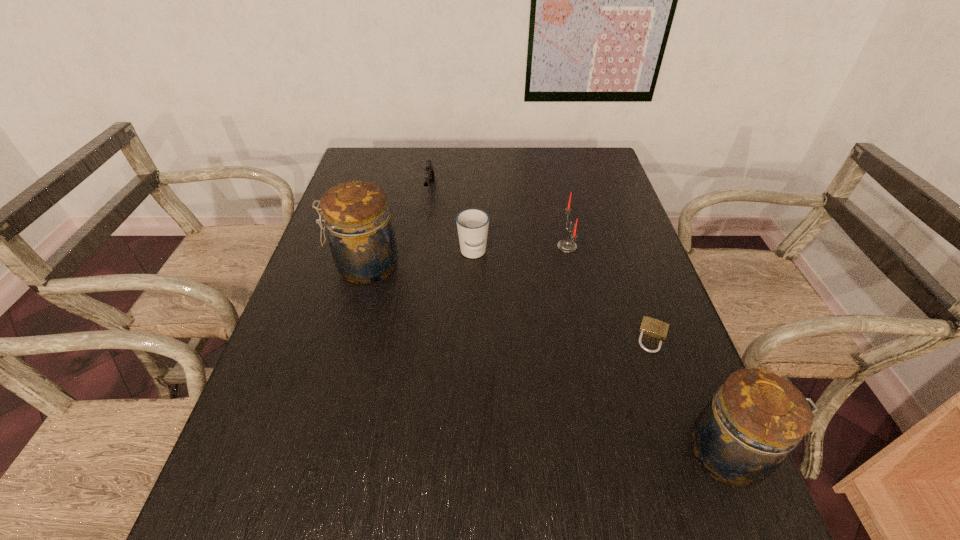
The width and height of the screenshot is (960, 540). Find the location of `object present at the left edge`. object present at the left edge is located at coordinates (361, 238).

Find the location of a particular element. jar located in the right edge section of the desktop is located at coordinates (741, 437).

Locate an element on the screen. This screenshot has height=540, width=960. padlock located in the right edge section of the desktop is located at coordinates (652, 327).

In order to click on object that is at the near right corner in this screenshot , I will do `click(741, 437)`.

Locate an element on the screen. The height and width of the screenshot is (540, 960). vacant space at the far edge is located at coordinates (463, 150).

This screenshot has height=540, width=960. I want to click on vacant space at the near edge of the desktop, so click(x=421, y=450).

What are the coordinates of `vacant region at the left edge of the desktop` in the screenshot? It's located at (286, 388).

The image size is (960, 540). I want to click on free region at the right edge of the desktop, so click(611, 207).

The height and width of the screenshot is (540, 960). In order to click on vacant space at the far left corner of the desktop in this screenshot , I will do `click(397, 152)`.

Find the location of a particular element. The image size is (960, 540). blank region between the fourth tallest object and the farther jar is located at coordinates (420, 260).